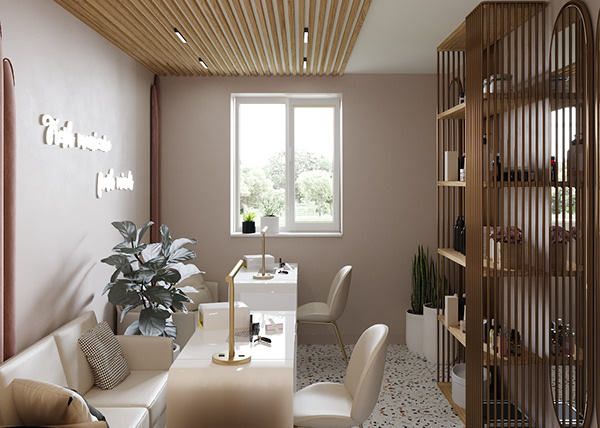
You are a GUI agent. You are given a task and a screenshot of the screen. Output one action in this format:
    pyautogui.click(x=<x>, y=<y>)
    Task: Click on the wall art
    The height and width of the screenshot is (428, 600).
    Given the screenshot: What is the action you would take?
    pyautogui.click(x=60, y=140), pyautogui.click(x=88, y=138), pyautogui.click(x=103, y=180), pyautogui.click(x=121, y=180)